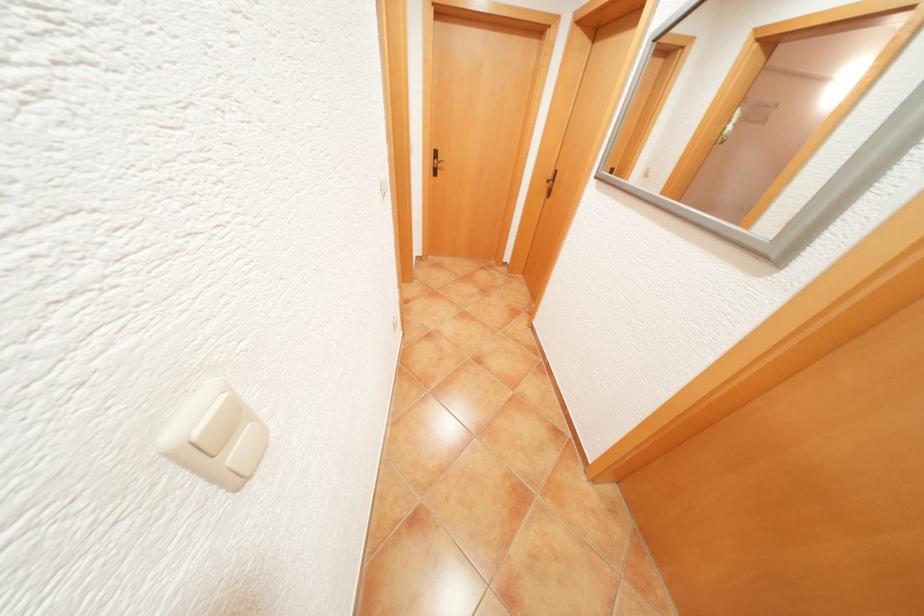
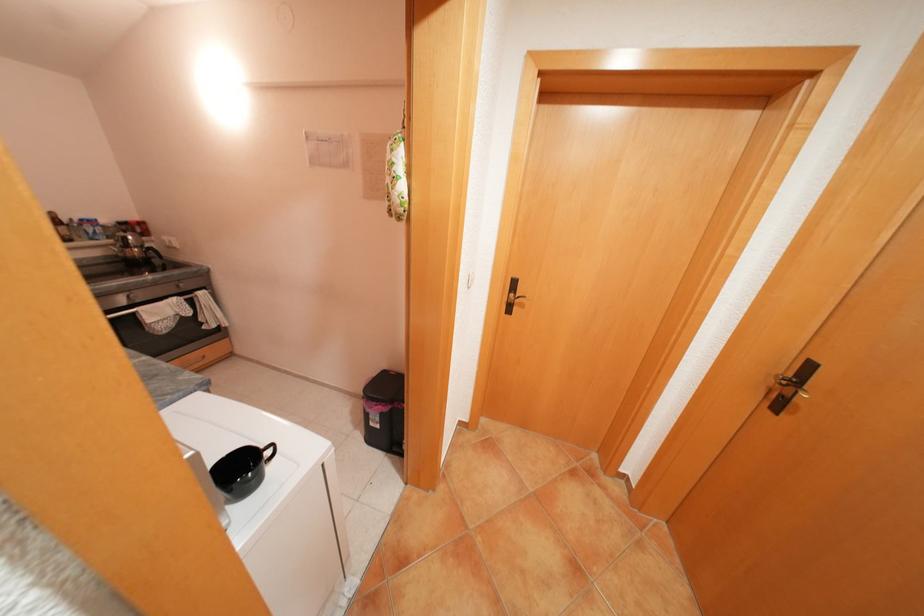
Question: In a continuous first-person perspective shot, in which direction is the camera moving?

Choices:
 (A) Left
 (B) Right
 (C) Forward
 (D) Backward

Answer: (C)